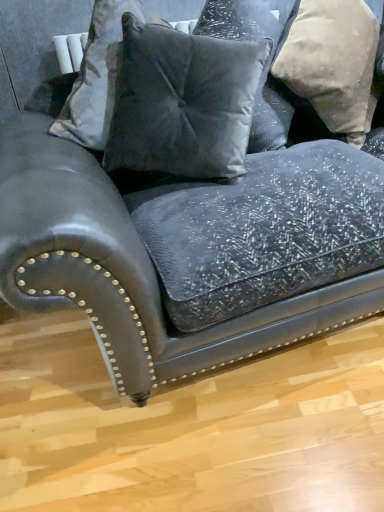
Question: From a real-world perspective, is velvet gray pillow at center, the first pillow positioned from the left, positioned above or below velvet gray pillow at upper center, placed as the second pillow when sorted from left to right?

Choices:
 (A) below
 (B) above

Answer: (B)

Question: Is point [124, 60] closer or farther from the camera than point [205, 25]?

Choices:
 (A) closer
 (B) farther

Answer: (A)

Question: Based on their relative distances, which object is farther from the velvet gray pillow at center, which is counted as the 3th pillow, starting from the right?

Choices:
 (A) beige textured pillow at upper right, positioned as the first pillow in right-to-left order
 (B) velvet gray pillow at upper center, which is the 2th pillow from right to left

Answer: (A)

Question: Which is farther from the velvet gray pillow at upper center, placed as the second pillow when sorted from left to right?

Choices:
 (A) velvet gray pillow at center, which is counted as the 3th pillow, starting from the right
 (B) beige textured pillow at upper right, positioned as the first pillow in right-to-left order

Answer: (A)